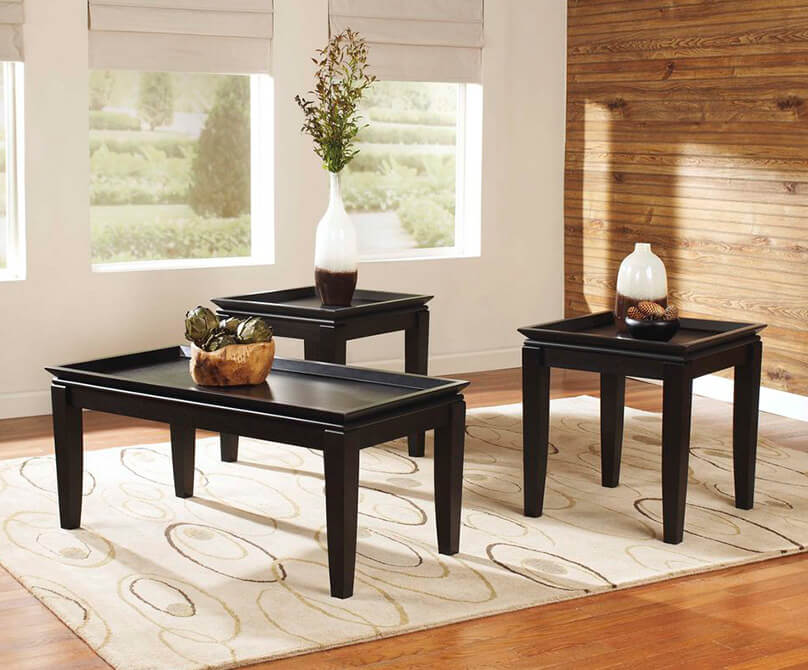
Image resolution: width=808 pixels, height=670 pixels. In order to click on plant in this screenshot , I will do `click(305, 84)`, `click(338, 92)`.